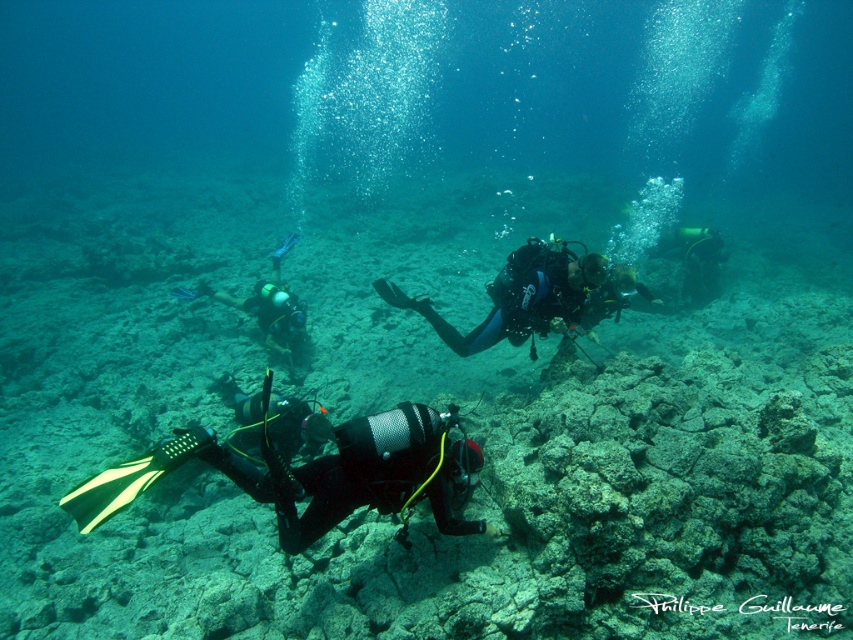
You are a marine biologist studying underwater equipment placement. You observe a point at coordinates (360, 474) in your underwater camera feed. Based on the scene description, what object does this point correspond to?

The point at coordinates (360, 474) corresponds to the black mesh wetsuit at center.